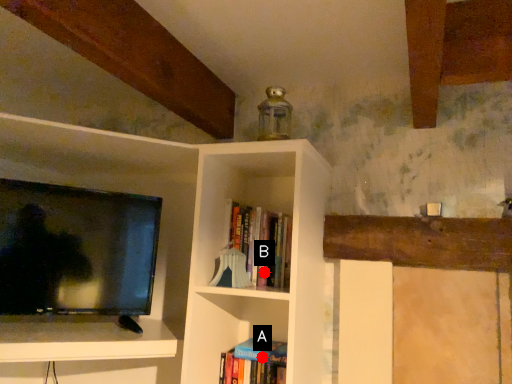
Question: Two points are circled on the image, labeled by A and B beside each circle. Which point is farther to the camera?

Choices:
 (A) A is further
 (B) B is further

Answer: (A)